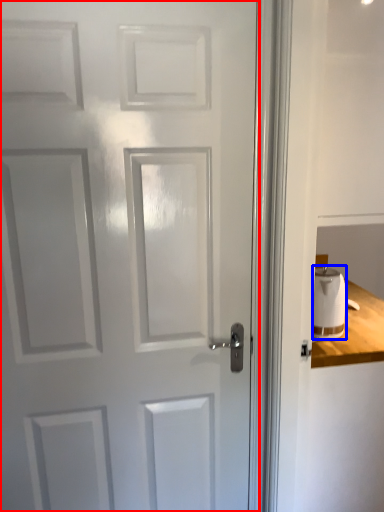
Question: Which of the following is the closest to the observer, door (highlighted by a red box) or toilet paper (highlighted by a blue box)?

Choices:
 (A) door
 (B) toilet paper

Answer: (A)